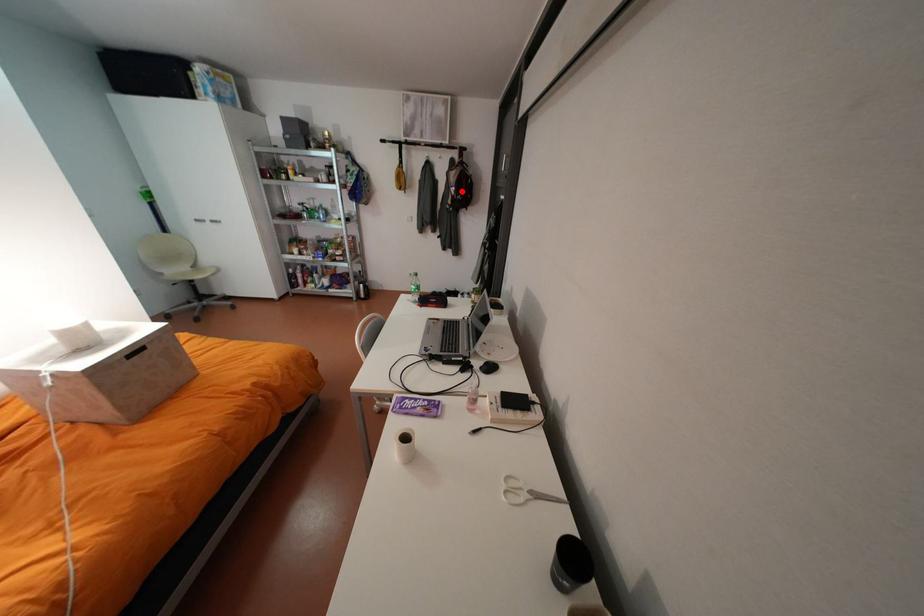
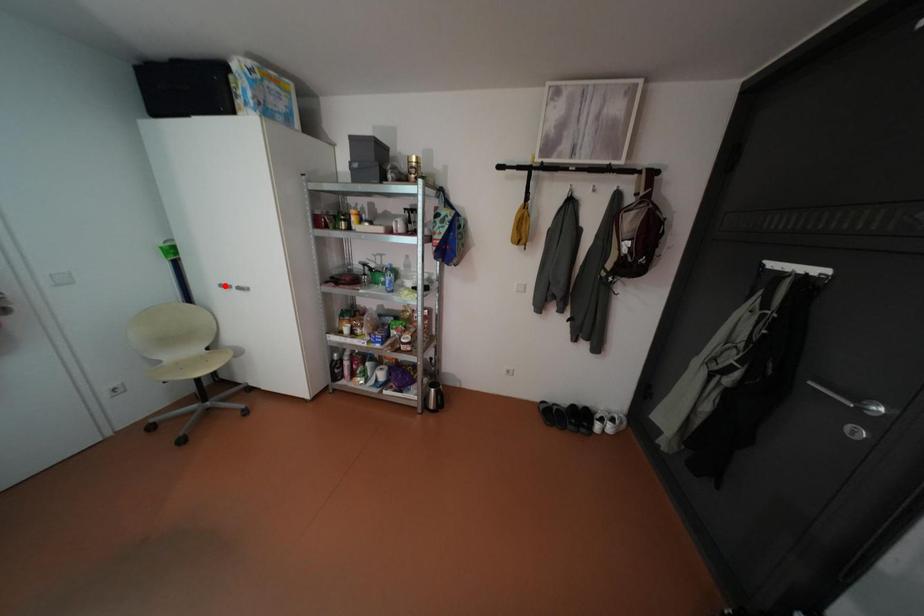
I am providing you with two images of the same scene from different viewpoints. A red point is marked on the first image and another point is marked on the second image. Is the marked point in image1 the same physical position as the marked point in image2?

No